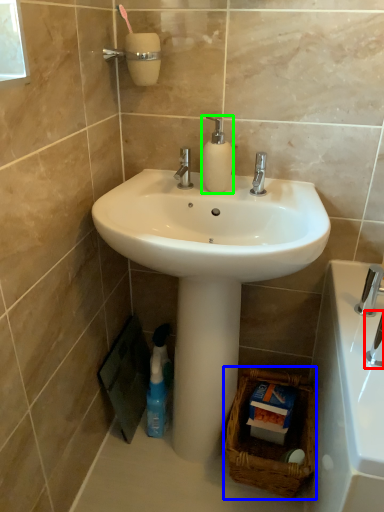
Question: Which is nearer to the plumbing fixture (highlighted by a red box)? basket (highlighted by a blue box) or soap dispenser (highlighted by a green box).

Choices:
 (A) basket
 (B) soap dispenser

Answer: (A)